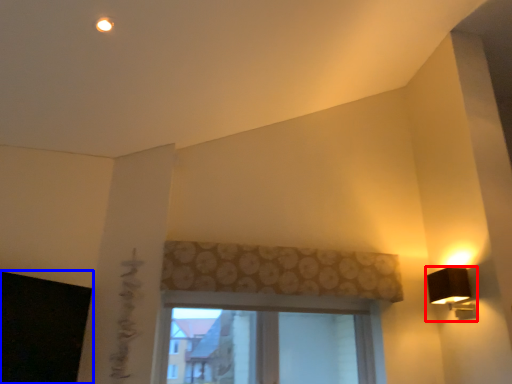
Question: Among these objects, which one is nearest to the camera, lamp (highlighted by a red box) or window screen (highlighted by a blue box)?

Choices:
 (A) lamp
 (B) window screen

Answer: (B)